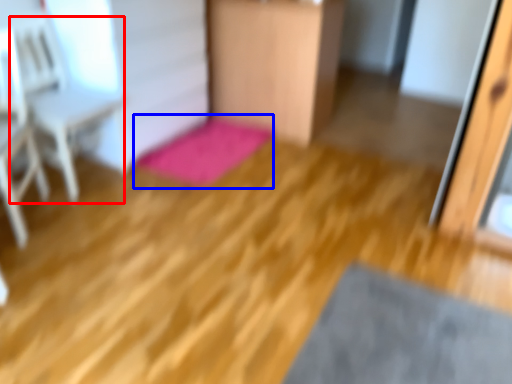
Question: Among these objects, which one is nearest to the camera, armchair (highlighted by a red box) or bath mat (highlighted by a blue box)?

Choices:
 (A) armchair
 (B) bath mat

Answer: (A)